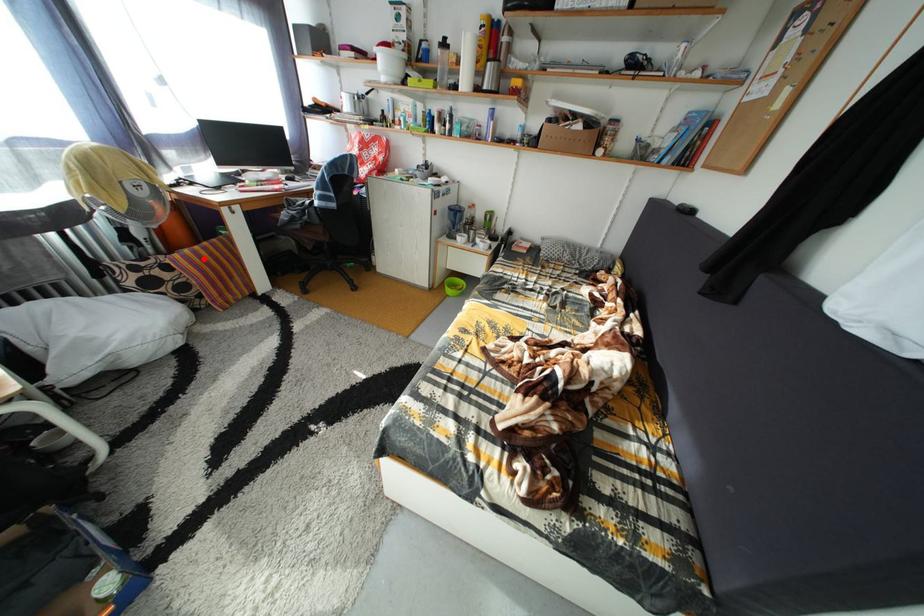
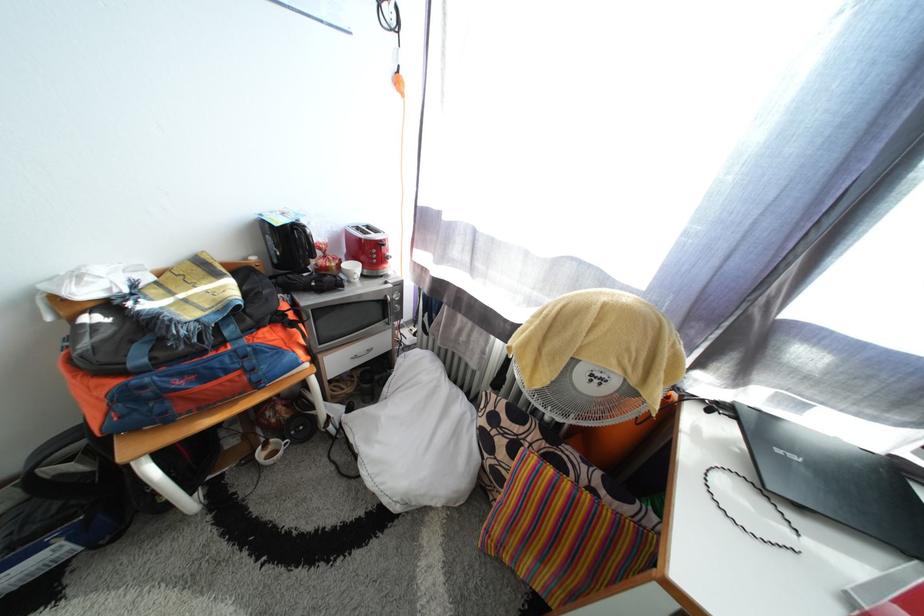
Question: I am providing you with two images of the same scene from different viewpoints. Image1 has a red point marked. In image2, the corresponding 3D location appears at what relative position? Reply with the corresponding letter.

Choices:
 (A) Closer
 (B) Farther

Answer: (B)